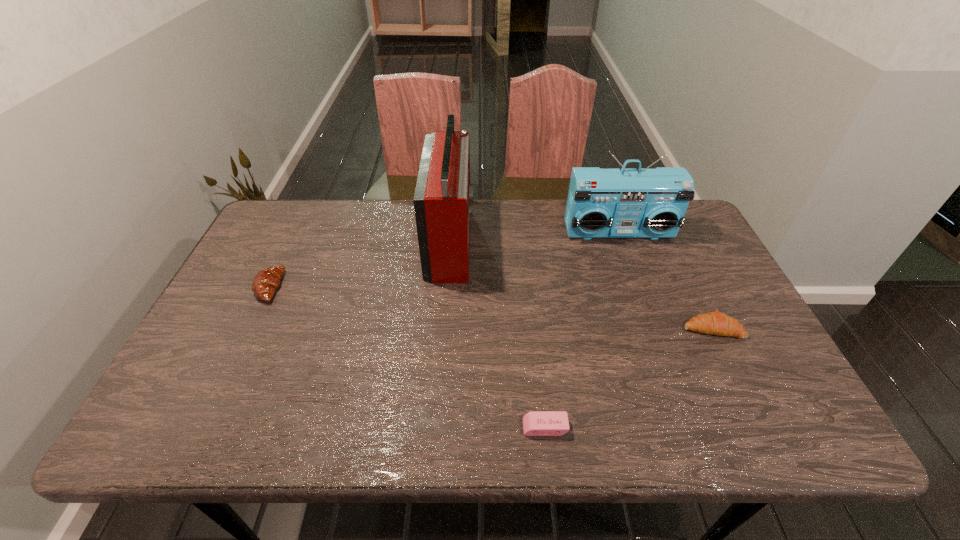
I want to click on vacant space that satisfies the following two spatial constraints: 1. on the front-facing side of the taller radio receiver; 2. on the back side of the nearer crescent roll, so tap(444, 328).

You are a GUI agent. You are given a task and a screenshot of the screen. Output one action in this format:
    pyautogui.click(x=<x>, y=<y>)
    Task: Click on the free space that satisfies the following two spatial constraints: 1. on the front side of the second nearest object; 2. on the right side of the farther crescent roll
    
    Given the screenshot: What is the action you would take?
    pyautogui.click(x=250, y=328)